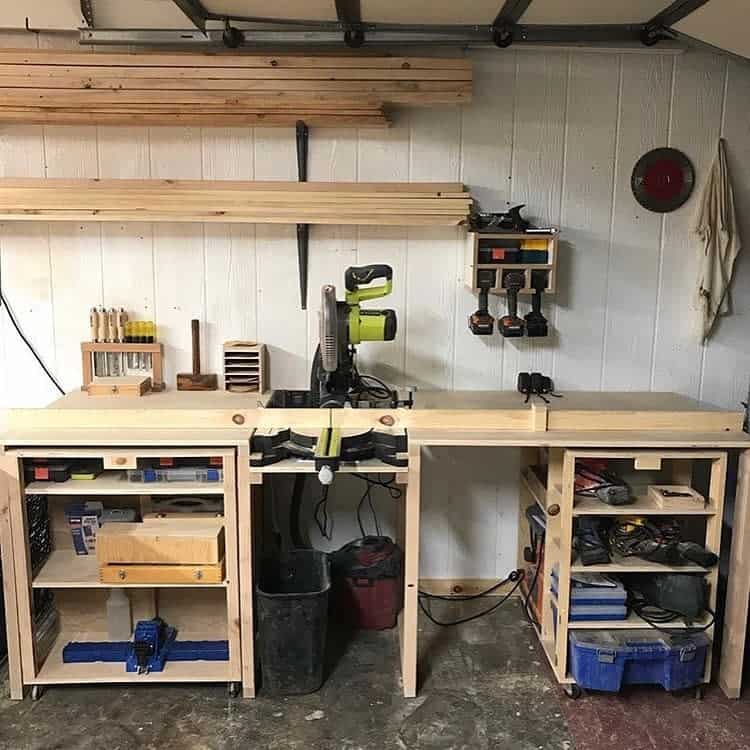
Identify the location of wood planks. The height and width of the screenshot is (750, 750). (219, 106), (193, 208).